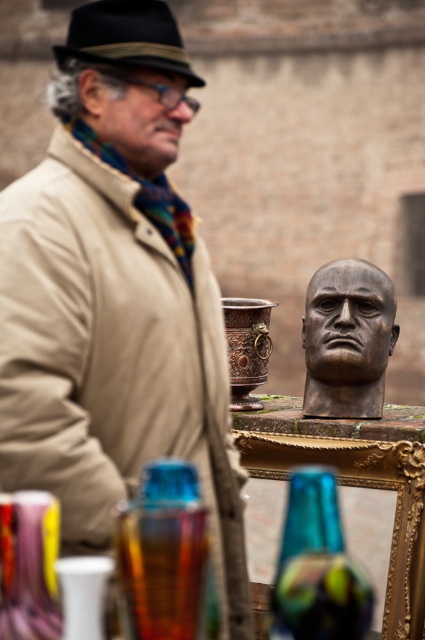
Question: Considering the real-world distances, which object is closest to the matte black fedora at upper left?

Choices:
 (A) translucent amber glass vase at lower left
 (B) matte brown wooden head at center
 (C) beige wool coat at left

Answer: (B)

Question: Is translucent amber glass vase at lower left above bronze head at center?

Choices:
 (A) yes
 (B) no

Answer: (B)

Question: Can you confirm if bronze head at center is smaller than translucent iridescent vase at center?

Choices:
 (A) yes
 (B) no

Answer: (A)

Question: Does bronze head at center have a greater width compared to translucent iridescent vase at center?

Choices:
 (A) yes
 (B) no

Answer: (A)

Question: Among these objects, which one is farthest from the camera?

Choices:
 (A) bronze head at center
 (B) beige wool coat at left
 (C) copper metallic pot at center
 (D) matte black fedora at upper left

Answer: (C)

Question: Which of these objects is positioned closest to the copper metallic pot at center?

Choices:
 (A) beige wool coat at left
 (B) matte black fedora at upper left

Answer: (A)